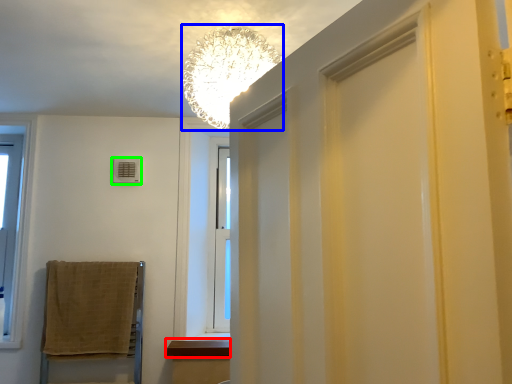
Question: Considering the real-world distances, which object is farthest from window sill (highlighted by a red box)? lamp (highlighted by a blue box) or air conditioner (highlighted by a green box)?

Choices:
 (A) lamp
 (B) air conditioner

Answer: (A)